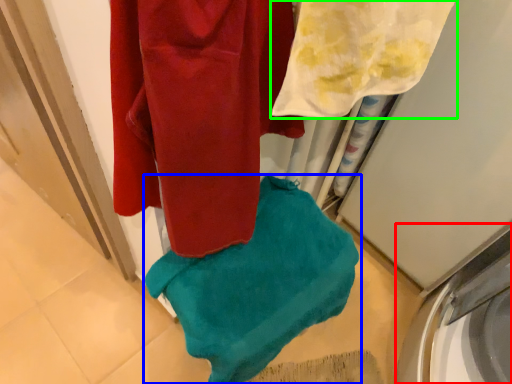
Question: Estimate the real-world distances between objects in this image. Which object is farther from washing machine (highlighted by a red box), towel (highlighted by a blue box) or towel (highlighted by a green box)?

Choices:
 (A) towel
 (B) towel

Answer: (B)